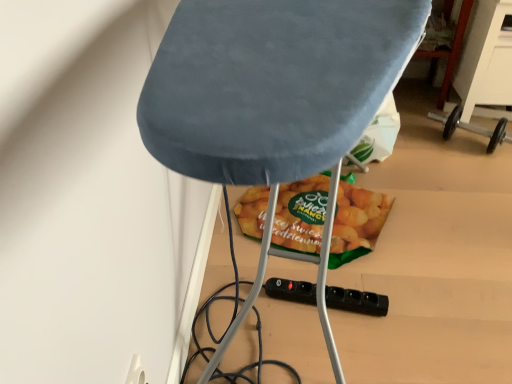
Identify the location of vacant area located to the right-hand side of velvet blue ironing board at center. This screenshot has height=384, width=512. (449, 241).